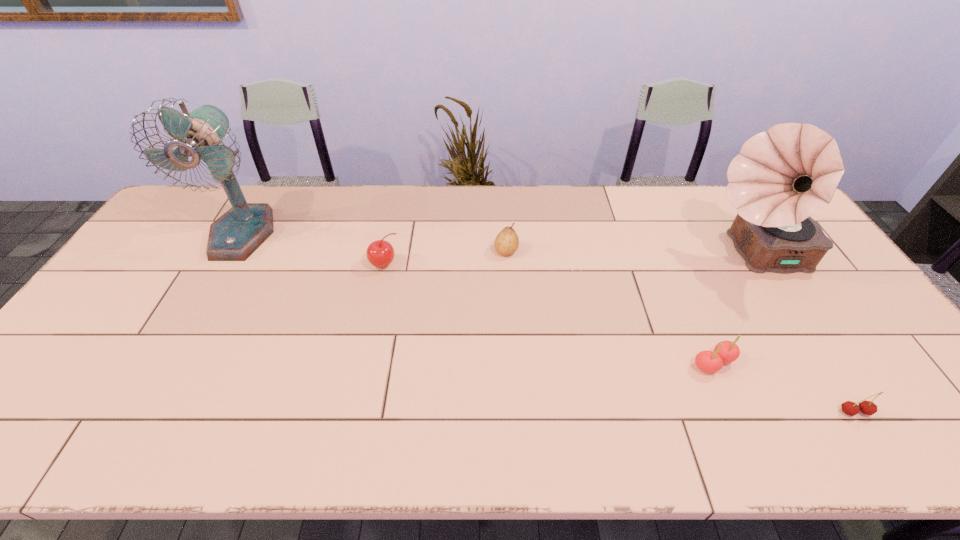
Locate an element on the screen. cherry that can be found as the closest to the third object from left to right is located at coordinates (380, 253).

Find the location of a particular element. Image resolution: width=960 pixels, height=540 pixels. the second closest cherry relative to the pear is located at coordinates (x=725, y=351).

Identify the location of vacant space that satisfies the following two spatial constraints: 1. in front of the second cherry from left to right where the wind blows; 2. on the left side of the fan. (168, 363).

Where is `free spot that satisfies the following two spatial constraints: 1. in front of the farthest cherry where the wind blows; 2. on the left side of the fan`? This screenshot has width=960, height=540. free spot that satisfies the following two spatial constraints: 1. in front of the farthest cherry where the wind blows; 2. on the left side of the fan is located at coordinates (225, 265).